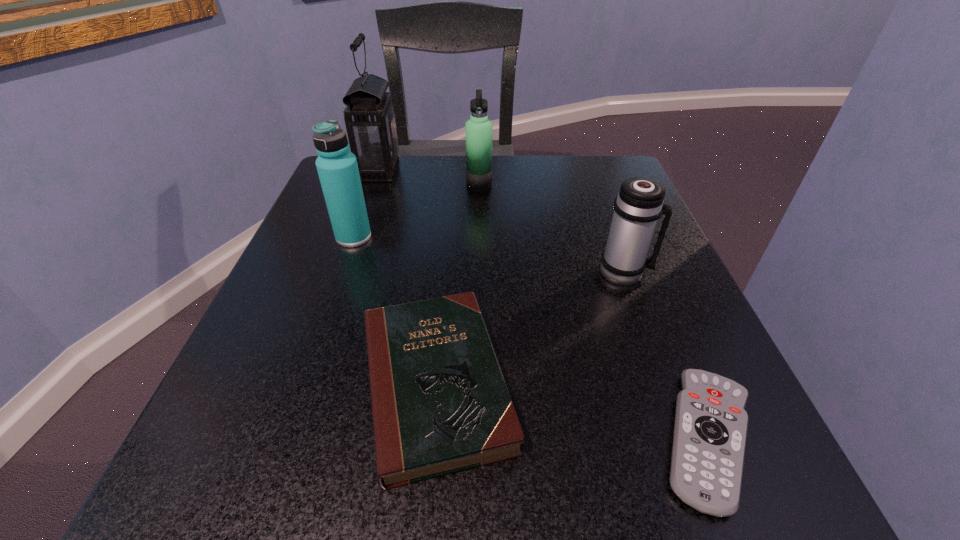
Identify the location of the tallest object. (370, 122).

Locate an element on the screen. This screenshot has width=960, height=540. the second farthest thermos bottle is located at coordinates (337, 167).

The image size is (960, 540). Find the location of `the leftmost thermos bottle`. the leftmost thermos bottle is located at coordinates pos(337,167).

Find the location of `the farthest thermos bottle`. the farthest thermos bottle is located at coordinates (479, 129).

You are a GUI agent. You are given a task and a screenshot of the screen. Output one action in this format:
    pyautogui.click(x=<x>, y=<y>)
    Task: Click on the rightmost thermos bottle
    The width and height of the screenshot is (960, 540).
    Given the screenshot: What is the action you would take?
    pyautogui.click(x=639, y=204)

Image resolution: width=960 pixels, height=540 pixels. I want to click on the shortest thermos bottle, so click(639, 204).

Where is `Bible`? Bible is located at coordinates (440, 404).

Where is `the shortest object`? Image resolution: width=960 pixels, height=540 pixels. the shortest object is located at coordinates (710, 430).

Where is `free space located 0.140m on the front-facing side of the tallest object`? free space located 0.140m on the front-facing side of the tallest object is located at coordinates (459, 171).

The height and width of the screenshot is (540, 960). Identify the location of vacant area situated 0.110m on the right of the fourth nearest object. (429, 237).